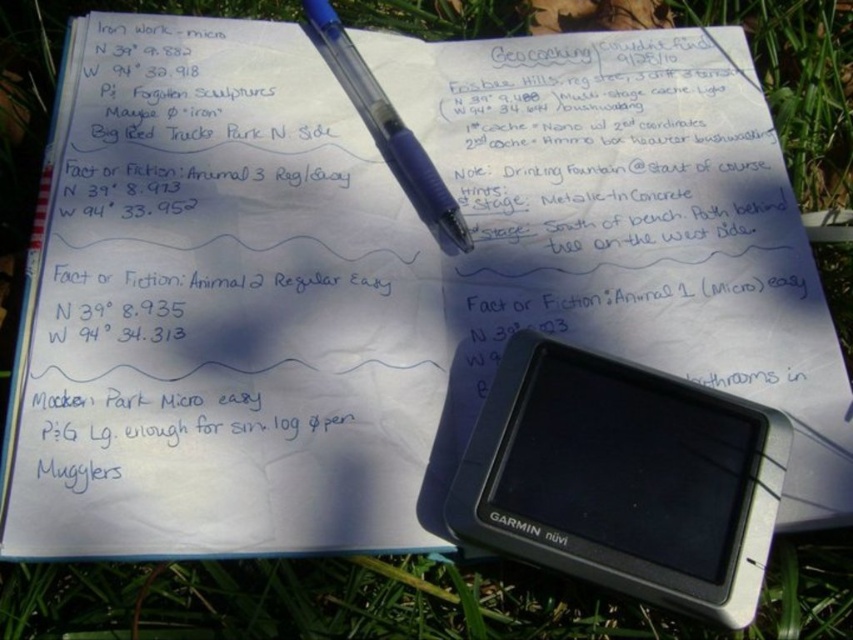
Measure the distance between point [744,467] and camera.

Point [744,467] is 35.56 inches from camera.

Who is more distant from viewer, (x=744, y=515) or (x=421, y=156)?

The point (x=421, y=156) is more distant.

Locate an element on the screen. The width and height of the screenshot is (853, 640). black plastic gps at center is located at coordinates (624, 477).